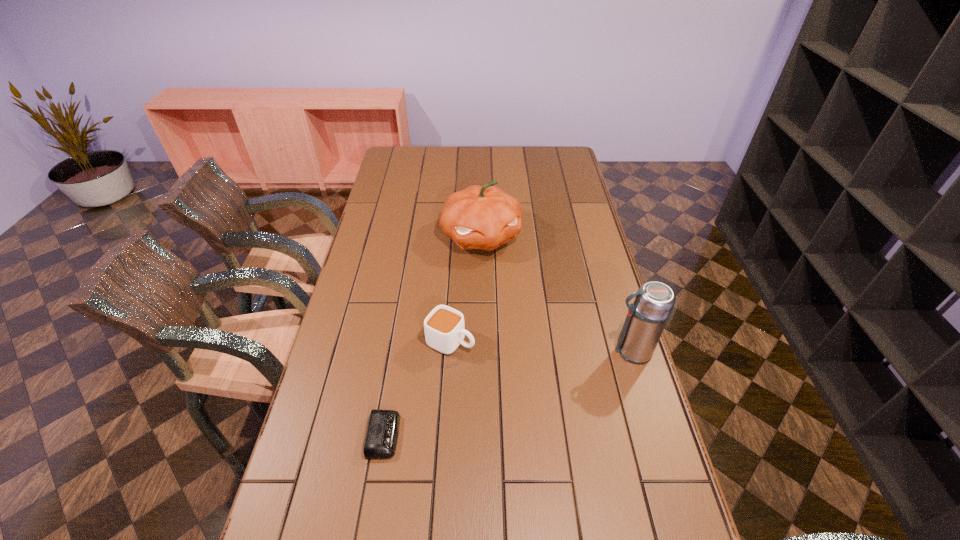
Where is `free point located 0.160m on the front face of the pumpkin`? Image resolution: width=960 pixels, height=540 pixels. free point located 0.160m on the front face of the pumpkin is located at coordinates (507, 293).

Find the location of a particular element. Image resolution: width=960 pixels, height=540 pixels. blank space located 0.110m on the front face of the pumpkin is located at coordinates (502, 282).

This screenshot has width=960, height=540. I want to click on vacant region located on the side with the handle of the third tallest object, so click(x=573, y=397).

Identify the location of free space located on the side with the handle of the third tallest object. (492, 359).

Where is `blank space located on the side with the handle of the third tallest object`? This screenshot has height=540, width=960. blank space located on the side with the handle of the third tallest object is located at coordinates (545, 384).

This screenshot has width=960, height=540. I want to click on object that is positioned at the right edge, so click(646, 319).

At what (x,y) coordinates should I click in order to perform the action: click on vacant space at the far edge. Please return your answer as a coordinate pair (x, y). Looking at the image, I should click on (464, 166).

In the image, there is a desktop. Where is `vacant space at the near edge`? vacant space at the near edge is located at coordinates (465, 495).

This screenshot has height=540, width=960. In the image, there is a desktop. What are the coordinates of `vacant space at the left edge` in the screenshot? It's located at (396, 231).

In the image, there is a desktop. At what (x,y) coordinates should I click in order to perform the action: click on vacant area at the right edge. Please return your answer as a coordinate pair (x, y). This screenshot has width=960, height=540. Looking at the image, I should click on (549, 190).